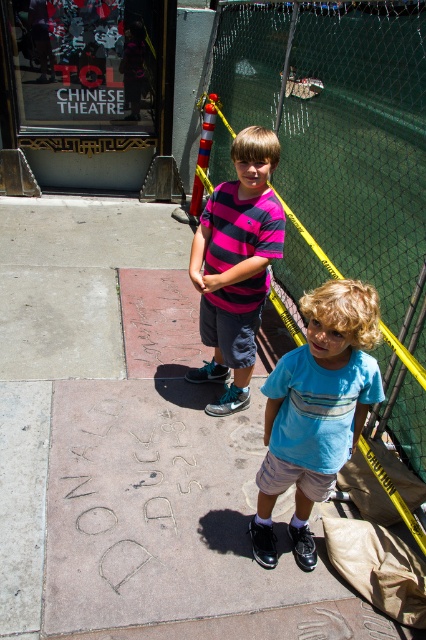
Which of these two, yellow/yellow mesh fence at upper center or blue cotton shirt at center, stands shorter?

With less height is blue cotton shirt at center.

Image resolution: width=426 pixels, height=640 pixels. What are the coordinates of `yellow/yellow mesh fence at upper center` in the screenshot? It's located at (339, 138).

Does concrete sidewalk at center have a greater width compared to blue cotton shirt at center?

Indeed, concrete sidewalk at center has a greater width compared to blue cotton shirt at center.

Which is behind, point (252, 452) or point (331, 284)?

The point (252, 452) is behind.

Is point (166, 554) closer to viewer compared to point (275, 390)?

No.

Where is `concrete sidewalk at center`? concrete sidewalk at center is located at coordinates (131, 449).

Can you confirm if concrete sidewalk at center is taller than pink striped shirt at center?

Yes, concrete sidewalk at center is taller than pink striped shirt at center.

Who is more forward, (65,428) or (195,260)?

Point (195,260) is more forward.

Find the location of a particular element. concrete sidewalk at center is located at coordinates (131, 449).